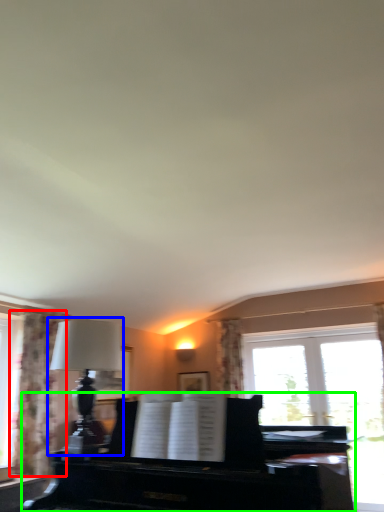
Question: Estimate the real-world distances between objects in this image. Which object is closer to curtain (highlighted by a red box), table lamp (highlighted by a blue box) or piano (highlighted by a green box)?

Choices:
 (A) table lamp
 (B) piano

Answer: (A)